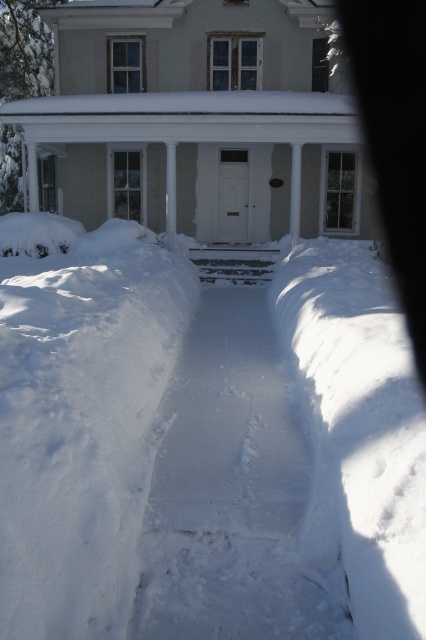
You are standing at the front door of the two story house with light gray exterior and white trim. You want to walk to the point marked at coordinate (232,492). According to the image, will you have to walk through any snow? Please answer yes or no.

The point at coordinate (232,492) is on white snow at center, so yes, you will have to walk through snow to reach it.

You are a delivery person trying to reach the front door of the house. You see the white snow at center and the white smooth porch at center. Which one should you step on to reach the door safely?

You should step on the white smooth porch at center because it is larger than the white snow at center, making it a more stable and safe surface for walking towards the door.

You are a delivery person with a heavy package that requires you to walk 16 meters to reach the front door. You see the white snow at center and the white smooth porch at center. Can you make it to the porch without exceeding your walking limit?

The distance between the white snow at center and the white smooth porch at center is 15.67 meters, so yes, you can make it to the porch without exceeding your 16 meters walking limit.